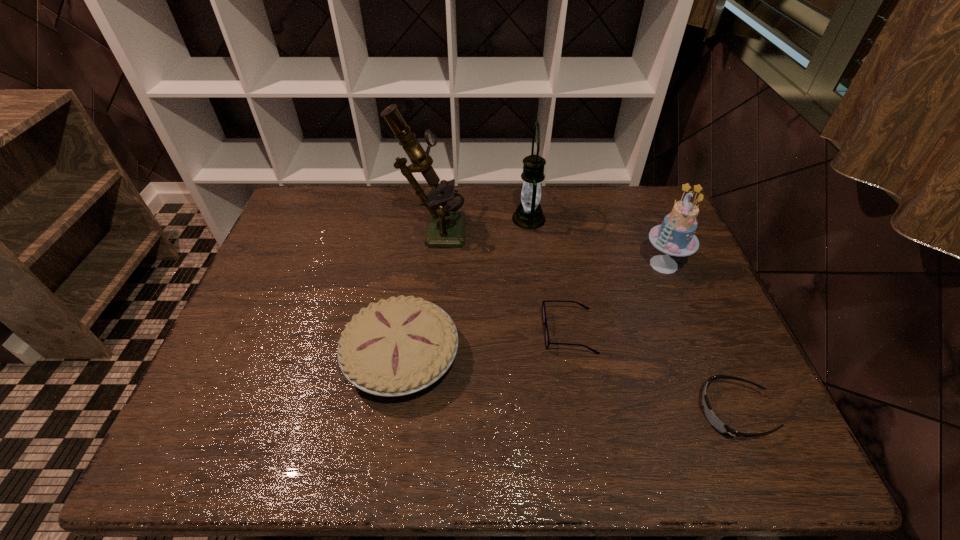
The image size is (960, 540). Find the location of `vacant area that lies between the third tallest object and the pie`. vacant area that lies between the third tallest object and the pie is located at coordinates point(533,310).

Identify the location of free spot between the spectacles and the third tallest object. (616, 298).

Where is `object that is the fourth closest to the lantern`? object that is the fourth closest to the lantern is located at coordinates (395, 347).

At what (x,y) coordinates should I click in order to perform the action: click on object that is the second closest to the sunglasses. Please return your answer as a coordinate pair (x, y). Image resolution: width=960 pixels, height=540 pixels. Looking at the image, I should click on click(x=675, y=236).

Locate an element on the screen. This screenshot has width=960, height=540. vacant space that satisfies the following two spatial constraints: 1. on the front-facing side of the spectacles; 2. on the front side of the pie is located at coordinates (573, 357).

This screenshot has width=960, height=540. I want to click on free space that satisfies the following two spatial constraints: 1. with a ladder on the side of the cake; 2. on the front side of the fourth tallest object, so click(x=702, y=357).